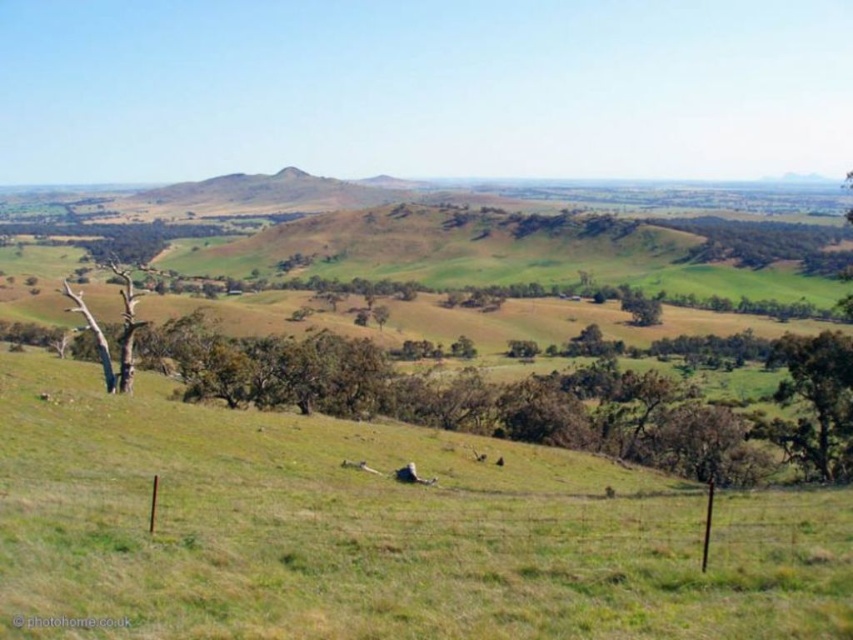
You are a hiker standing at the base of the dead wood tree at left and want to reach the green leafy tree at lower right. Which direction should you walk to get there?

You should walk towards the lower right direction because the green leafy tree at lower right is positioned under the dead wood tree at left, meaning it is located below and to the right of your current position.

You are standing at point (123, 291) and want to walk to point (781, 392). Given the terrain described in the scene, will you have to climb any hills along the way?

The path from point (123, 291) to point (781, 392) goes through the middle ground, which has rolling hills with uneven terrain. You will encounter some elevation changes, so yes, you will have to climb hills along the way.